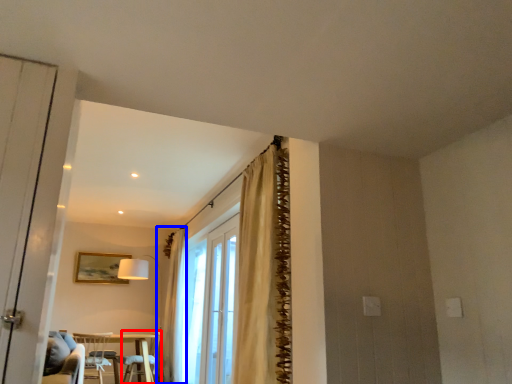
Question: Among these objects, which one is farthest to the camera, armchair (highlighted by a red box) or curtain (highlighted by a blue box)?

Choices:
 (A) armchair
 (B) curtain

Answer: (B)